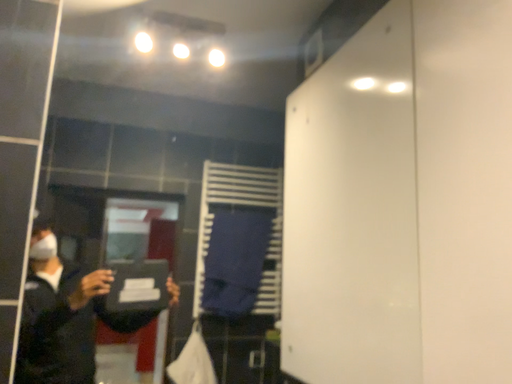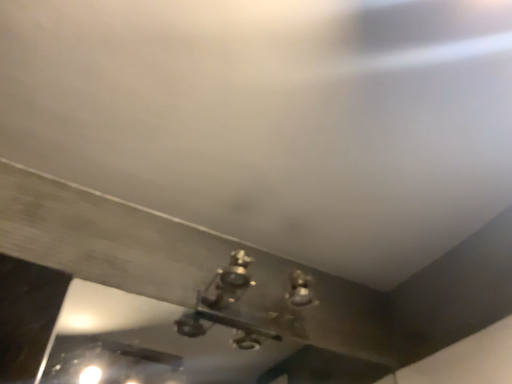
Question: Which way did the camera rotate in the video?

Choices:
 (A) rotated downward
 (B) rotated upward

Answer: (B)